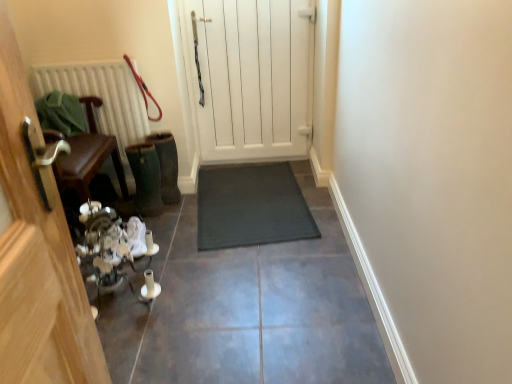
Locate an element on the screen. This screenshot has width=512, height=384. empty space that is ontop of dark gray rubber mat at center (from a real-world perspective) is located at coordinates (223, 262).